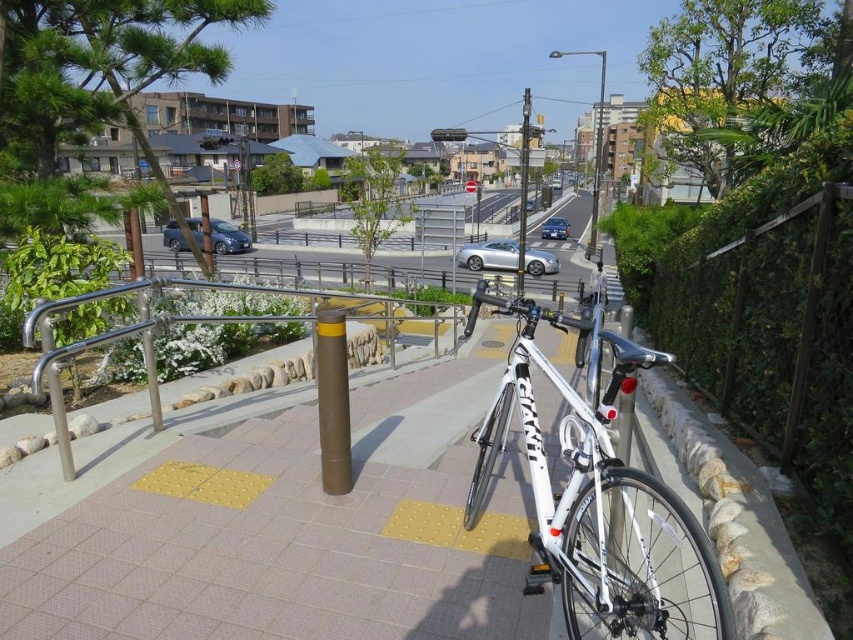
You are a delivery drone operator. Your drone needs to fly from the silver metallic handrail at center to the silver metallic sedan at left. The drone has a maximum flight range of 50 feet. Can the drone complete the trip without needing to recharge?

The distance between the silver metallic handrail at center and the silver metallic sedan at left is 47.36 feet, which is within the drone operator stated maximum flight range of 50 feet. Therefore, the drone can complete the trip without needing to recharge.

You are standing at the center of the image and want to locate the metallic pole at center. Which direction should you look to find it?

The metallic pole at center is located at the center of the image, so you should look straight ahead to find it.

You are a pedestrian trying to cross the road safely. You see a silver metallic handrail at center and a silver metallic sedan at left. Which object should you approach first to ensure safety?

The silver metallic sedan at left is on the left side, so you should approach the silver metallic handrail at center first to ensure safety since it is positioned to the right of the sedan and likely part of the pedestrian pathway.